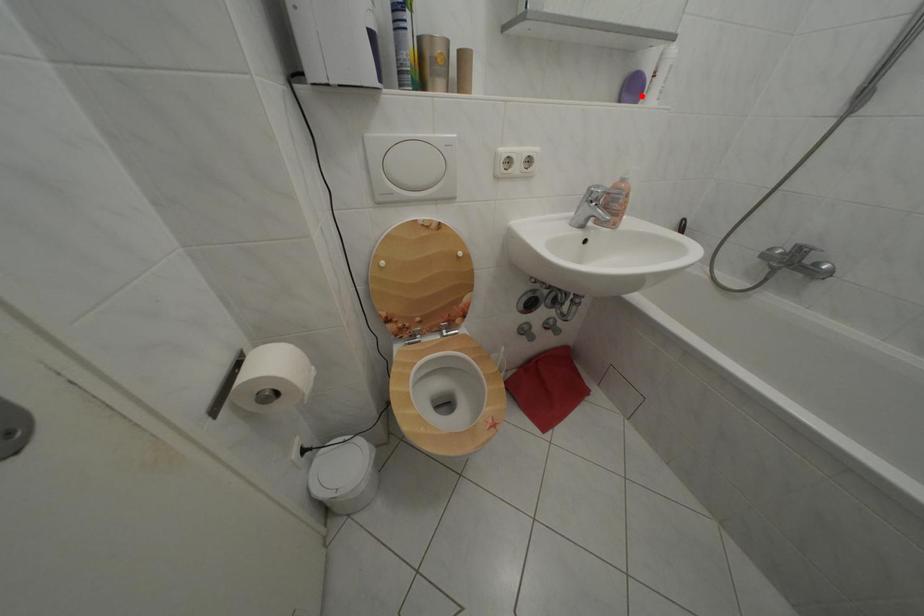
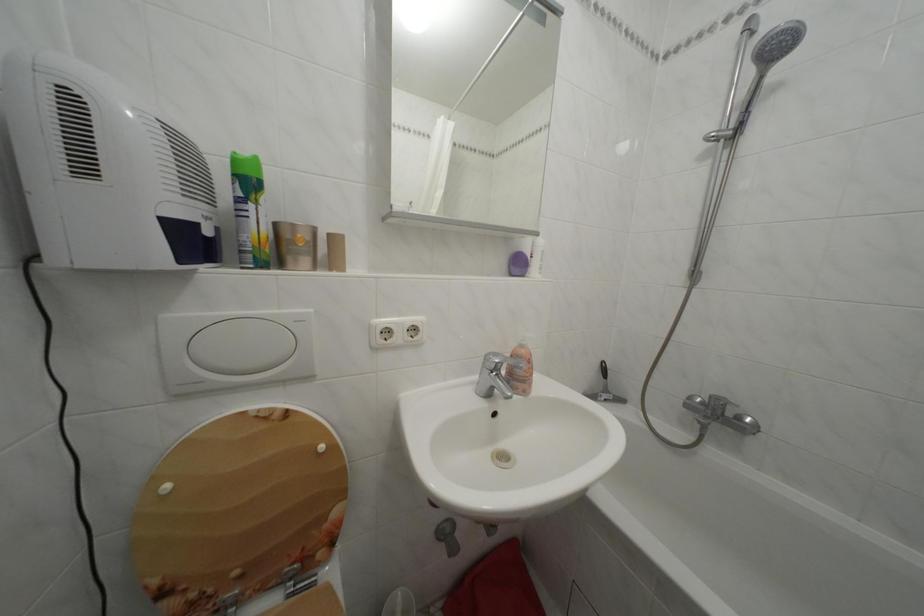
In the second image, find the point that corresponds to the highlighted location in the first image.

(527, 270)